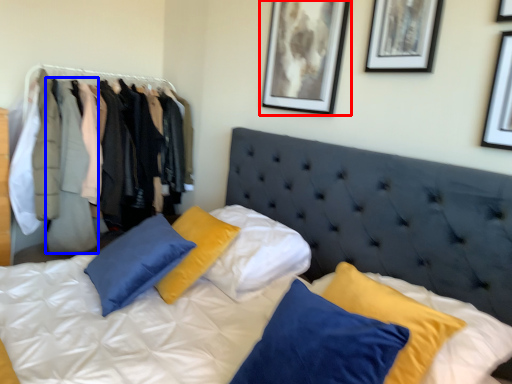
Question: Which point is further to the camera, picture frame (highlighted by a red box) or clothing (highlighted by a blue box)?

Choices:
 (A) picture frame
 (B) clothing

Answer: (B)